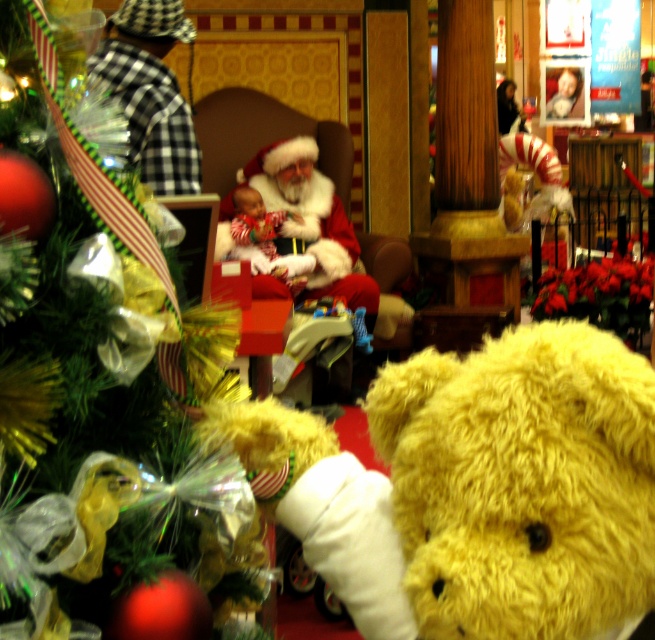
You are a photographer setting up a shot for the holiday display. You need to adjust the lighting so that the shiny green tinsel at left and the fuzzy red santa at center are both well lit. Since you can only focus the light on one object at a time, which object should you light first if you want to ensure the other is also adequately lit?

Since the shiny green tinsel at left is to the right of the fuzzy red santa at center, you should light the fuzzy red santa at center first. This way, the light will naturally spread towards the tinsel at the right, ensuring both are adequately lit.

You are a photographer setting up for a holiday photo shoot. You want to ensure that both the yellow plush bear at center and the fuzzy red santa at center are in focus. Which object should you adjust your camera focus on first to ensure the closest one is properly captured?

The yellow plush bear at center is closer to the viewer than the fuzzy red santa at center, so you should focus on the yellow plush bear at center first to ensure proper focus on the nearest subject.